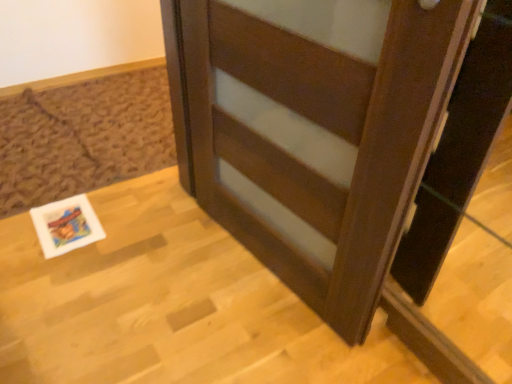
The width and height of the screenshot is (512, 384). What do you see at coordinates (329, 145) in the screenshot?
I see `brown wood door at center` at bounding box center [329, 145].

At what (x,y) coordinates should I click in order to perform the action: click on wooden table at center. Please return your answer as a coordinate pair (x, y). Image resolution: width=512 pixels, height=384 pixels. Looking at the image, I should click on (169, 306).

Is brown wood door at center outside of white glossy postcard at lower left?

Yes.

From a real-world perspective, is brown wood door at center physically located above or below white glossy postcard at lower left?

In terms of real-world spatial position, brown wood door at center is above white glossy postcard at lower left.

Does brown wood door at center have a larger size compared to white glossy postcard at lower left?

Yes.

Which is in front, brown wood door at center or white glossy postcard at lower left?

Positioned in front is brown wood door at center.

From a real-world perspective, is wooden table at center physically above white glossy postcard at lower left?

No.

From the image's perspective, is wooden table at center beneath white glossy postcard at lower left?

Correct, wooden table at center appears lower than white glossy postcard at lower left in the image.

In terms of size, does wooden table at center appear bigger or smaller than white glossy postcard at lower left?

Clearly, wooden table at center is larger in size than white glossy postcard at lower left.

Could you tell me if wooden table at center is facing white glossy postcard at lower left?

Yes, wooden table at center is aimed at white glossy postcard at lower left.

I want to click on furniture that appears in front of the wooden table at center, so click(x=329, y=145).

From a real-world perspective, is brown wood door at center on wooden table at center?

Yes, from a real-world perspective, brown wood door at center is over wooden table at center

From the image's perspective, is brown wood door at center positioned above or below wooden table at center?

From the image's perspective, brown wood door at center appears above wooden table at center.

Is the depth of brown wood door at center less than that of wooden table at center?

Yes, brown wood door at center is closer to the viewer.

From the image's perspective, is wooden table at center under brown wood door at center?

Correct, wooden table at center appears lower than brown wood door at center in the image.

I want to click on table below the brown wood door at center (from the image's perspective), so click(169, 306).

Is wooden table at center spatially inside brown wood door at center, or outside of it?

wooden table at center is outside brown wood door at center.

Who is taller, wooden table at center or brown wood door at center?

Standing taller between the two is brown wood door at center.

How distant is white glossy postcard at lower left from wooden table at center?

white glossy postcard at lower left and wooden table at center are 12.57 inches apart.

Considering the positions of objects white glossy postcard at lower left and wooden table at center in the image provided, who is more to the left, white glossy postcard at lower left or wooden table at center?

white glossy postcard at lower left is more to the left.

Looking at the image, does white glossy postcard at lower left seem bigger or smaller compared to wooden table at center?

Clearly, white glossy postcard at lower left is smaller in size than wooden table at center.

Considering their positions, is white glossy postcard at lower left located in front of or behind wooden table at center?

Visually, white glossy postcard at lower left is located behind wooden table at center.

From a real-world perspective, is white glossy postcard at lower left positioned above or below brown wood door at center?

In terms of real-world spatial position, white glossy postcard at lower left is below brown wood door at center.

This screenshot has height=384, width=512. What are the coordinates of `furniture on the right of the white glossy postcard at lower left` in the screenshot? It's located at (329, 145).

Is white glossy postcard at lower left smaller than brown wood door at center?

Yes.

Is white glossy postcard at lower left next to brown wood door at center and touching it?

No, white glossy postcard at lower left is not with brown wood door at center.

Where is `postcard beneath the brown wood door at center (from a real-world perspective)`? postcard beneath the brown wood door at center (from a real-world perspective) is located at coordinates (66, 225).

Identify the location of postcard above the wooden table at center (from a real-world perspective). The width and height of the screenshot is (512, 384). (66, 225).

From the image, which object appears to be farther from white glossy postcard at lower left, wooden table at center or brown wood door at center?

Among the two, brown wood door at center is located further to white glossy postcard at lower left.

Looking at the image, which one is located closer to brown wood door at center, wooden table at center or white glossy postcard at lower left?

wooden table at center.

When comparing their distances from white glossy postcard at lower left, does brown wood door at center or wooden table at center seem closer?

Based on the image, wooden table at center appears to be nearer to white glossy postcard at lower left.

Considering their positions, is brown wood door at center positioned further to wooden table at center than white glossy postcard at lower left?

Based on the image, brown wood door at center appears to be further to wooden table at center.

Which object lies further to the anchor point brown wood door at center, white glossy postcard at lower left or wooden table at center?

white glossy postcard at lower left is positioned further to the anchor brown wood door at center.

When comparing their distances from wooden table at center, does white glossy postcard at lower left or brown wood door at center seem closer?

white glossy postcard at lower left is positioned closer to the anchor wooden table at center.

Find the location of a particular element. table situated between white glossy postcard at lower left and brown wood door at center from left to right is located at coordinates (169, 306).